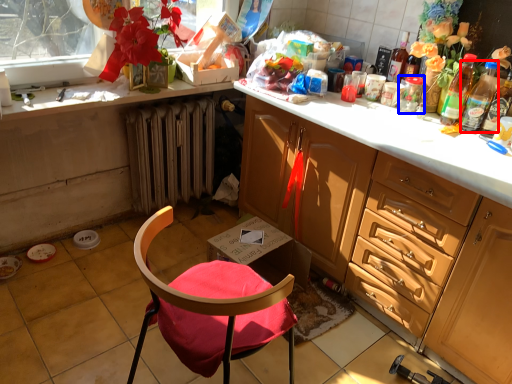
Question: Which object appears farthest to the camera in this image, bottle (highlighted by a red box) or glass jar (highlighted by a blue box)?

Choices:
 (A) bottle
 (B) glass jar

Answer: (B)